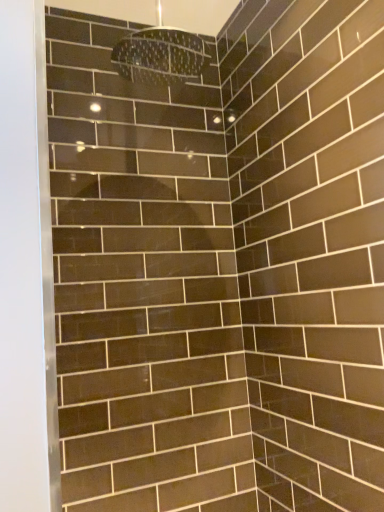
Find the location of a particular element. matte black showerhead at upper center is located at coordinates (161, 55).

Describe the element at coordinates (161, 55) in the screenshot. I see `matte black showerhead at upper center` at that location.

In order to face matte black showerhead at upper center, should I rotate leftwards or rightwards?

A 4.630 degree turn to the left will do.

At what (x,y) coordinates should I click in order to perform the action: click on matte black showerhead at upper center. Please return your answer as a coordinate pair (x, y). Looking at the image, I should click on (161, 55).